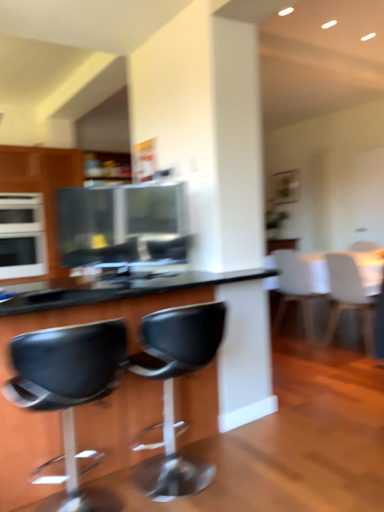
What is the approximate width of white glossy oven at left, the second appliance when ordered from right to left?

It is 25.52 inches.

Find the location of `white matte chair at right, the 4th chair viewed from the front`. white matte chair at right, the 4th chair viewed from the front is located at coordinates (300, 285).

Locate an element on the screen. The height and width of the screenshot is (512, 384). white matte chair at right, acting as the 1th chair starting from the right is located at coordinates (348, 296).

Locate an element on the screen. This screenshot has width=384, height=512. black plastic table at center, the first table positioned from the front is located at coordinates (166, 308).

Image resolution: width=384 pixels, height=512 pixels. Describe the element at coordinates (122, 224) in the screenshot. I see `metallic silver microwave at center, arranged as the second appliance when viewed from the back` at that location.

In order to face black leather stool at lower left, arranged as the 1th chair when viewed from the front, should I rotate leftwards or rightwards?

Turn left by 15.311 degrees to look at black leather stool at lower left, arranged as the 1th chair when viewed from the front.

Image resolution: width=384 pixels, height=512 pixels. Find the location of `white glossy oven at left, which appears as the second appliance when viewed from the front`. white glossy oven at left, which appears as the second appliance when viewed from the front is located at coordinates (22, 236).

Is white matte chair at right, the first chair positioned from the back, positioned before black plastic chair at center, arranged as the 2th chair when viewed from the front?

No, white matte chair at right, the first chair positioned from the back, is further to the viewer.

Starting from the white matte chair at right, which ranks as the second chair in right-to-left order, which chair is the 1st one to the left? Please provide its 2D coordinates.

[(173, 390)]

Based on the photo, is white matte chair at right, the 4th chair viewed from the front, beside black plastic chair at center, the third chair when ordered from back to front?

There is a gap between white matte chair at right, the 4th chair viewed from the front, and black plastic chair at center, the third chair when ordered from back to front.

Can you confirm if white matte chair at right, the first chair positioned from the back, is taller than black plastic chair at center, arranged as the 2th chair when viewed from the front?

Correct, white matte chair at right, the first chair positioned from the back, is much taller as black plastic chair at center, arranged as the 2th chair when viewed from the front.

Is white glossy oven at left, which appears as the second appliance when viewed from the front, situated inside white matte chair at right, which ranks as the second chair in right-to-left order, or outside?

The correct answer is: outside.

Can you confirm if white glossy oven at left, the 1th appliance from the back, is wider than white matte chair at right, the 3th chair in the left-to-right sequence?

Yes, white glossy oven at left, the 1th appliance from the back, is wider than white matte chair at right, the 3th chair in the left-to-right sequence.

Considering the relative sizes of white glossy oven at left, which appears as the second appliance when viewed from the front, and white matte chair at right, which ranks as the second chair in right-to-left order, in the image provided, is white glossy oven at left, which appears as the second appliance when viewed from the front, smaller than white matte chair at right, which ranks as the second chair in right-to-left order,?

Incorrect, white glossy oven at left, which appears as the second appliance when viewed from the front, is not smaller in size than white matte chair at right, which ranks as the second chair in right-to-left order.

Where is `appliance that appears behind the white matte chair at right, arranged as the 4th chair when viewed from the left`? The image size is (384, 512). appliance that appears behind the white matte chair at right, arranged as the 4th chair when viewed from the left is located at coordinates (22, 236).

Does white matte chair at right, arranged as the 4th chair when viewed from the left, have a greater width compared to white glossy oven at left, the 1th appliance from the left?

No.

Is white glossy oven at left, the 1th appliance from the left, inside white matte chair at right, placed as the third chair when sorted from front to back?

No, white glossy oven at left, the 1th appliance from the left, is not a part of white matte chair at right, placed as the third chair when sorted from front to back.

Considering the positions of point (323, 344) and point (17, 213), is point (323, 344) closer or farther from the camera than point (17, 213)?

Point (323, 344) is closer to the camera than point (17, 213).

Which is less distant, (x=315, y=258) or (x=171, y=378)?

The point (x=171, y=378) is in front.

Considering the relative sizes of white glossy table at upper right, marked as the first table in a right-to-left arrangement, and black plastic chair at center, the third chair when ordered from back to front, in the image provided, is white glossy table at upper right, marked as the first table in a right-to-left arrangement, bigger than black plastic chair at center, the third chair when ordered from back to front,?

Correct, white glossy table at upper right, marked as the first table in a right-to-left arrangement, is larger in size than black plastic chair at center, the third chair when ordered from back to front.

Which is more to the left, white glossy table at upper right, placed as the 2th table when sorted from left to right, or black plastic chair at center, arranged as the 2th chair when viewed from the front?

black plastic chair at center, arranged as the 2th chair when viewed from the front, is more to the left.

Is black plastic chair at center, the 3th chair from the right, oriented towards white glossy oven at left, the second appliance when ordered from right to left?

Yes, black plastic chair at center, the 3th chair from the right, is facing white glossy oven at left, the second appliance when ordered from right to left.

Is black plastic chair at center, the 3th chair from the right, beside white glossy oven at left, the 1th appliance from the left?

black plastic chair at center, the 3th chair from the right, and white glossy oven at left, the 1th appliance from the left, are not in contact.

Is black leather stool at lower left, which is counted as the 4th chair, starting from the back, oriented towards white glossy table at upper right, placed as the 2th table when sorted from left to right?

No, black leather stool at lower left, which is counted as the 4th chair, starting from the back, is not facing towards white glossy table at upper right, placed as the 2th table when sorted from left to right.

From the picture: Does black leather stool at lower left, arranged as the 1th chair when viewed from the front, appear on the left side of white glossy table at upper right, placed as the 2th table when sorted from left to right?

Correct, you'll find black leather stool at lower left, arranged as the 1th chair when viewed from the front, to the left of white glossy table at upper right, placed as the 2th table when sorted from left to right.

Is black leather stool at lower left, the first chair from the left, not near white glossy table at upper right, which is the second table from front to back?

Yes, black leather stool at lower left, the first chair from the left, and white glossy table at upper right, which is the second table from front to back, are quite far apart.

Would you say black leather stool at lower left, arranged as the 1th chair when viewed from the front, contains white glossy table at upper right, marked as the first table in a right-to-left arrangement?

No.

Are metallic silver microwave at center, the 1th appliance positioned from the front, and white glossy oven at left, the second appliance when ordered from right to left, far apart?

That's right, there is a large distance between metallic silver microwave at center, the 1th appliance positioned from the front, and white glossy oven at left, the second appliance when ordered from right to left.

In the image, is metallic silver microwave at center, the 1th appliance positioned from the front, on the left side or the right side of white glossy oven at left, the 1th appliance from the left?

metallic silver microwave at center, the 1th appliance positioned from the front, is to the right of white glossy oven at left, the 1th appliance from the left.

Which point is more forward, (62, 261) or (37, 195)?

The point (62, 261) is closer to the camera.

Looking at the image, does metallic silver microwave at center, acting as the 2th appliance starting from the left, seem bigger or smaller compared to white glossy oven at left, which appears as the second appliance when viewed from the front?

Clearly, metallic silver microwave at center, acting as the 2th appliance starting from the left, is smaller in size than white glossy oven at left, which appears as the second appliance when viewed from the front.

From the black plastic chair at center, the third chair when ordered from back to front, count 2nd chairs backward and point to it. Please provide its 2D coordinates.

[(300, 285)]

From the white glossy oven at left, the second appliance when ordered from right to left, count 3rd chair to the right and point to it. Please provide its 2D coordinates.

[(300, 285)]

Which object lies nearer to the anchor point white glossy table at upper right, which is the second table from front to back, metallic silver microwave at center, acting as the 2th appliance starting from the left, or black plastic chair at center, arranged as the 2th chair when viewed from the front?

metallic silver microwave at center, acting as the 2th appliance starting from the left, is closer to white glossy table at upper right, which is the second table from front to back.

Estimate the real-world distances between objects in this image. Which object is further from black leather stool at lower left, arranged as the 1th chair when viewed from the front, white matte chair at right, the 3th chair in the left-to-right sequence, or white matte chair at right, placed as the third chair when sorted from front to back?

white matte chair at right, the 3th chair in the left-to-right sequence.

Which object lies further to the anchor point black plastic chair at center, arranged as the 2th chair when viewed from the front, white glossy oven at left, which appears as the second appliance when viewed from the front, or white matte chair at right, which ranks as the second chair in right-to-left order?

white glossy oven at left, which appears as the second appliance when viewed from the front.

Which object lies nearer to the anchor point white matte chair at right, placed as the third chair when sorted from front to back, black plastic chair at center, acting as the 2th chair starting from the left, or metallic silver microwave at center, arranged as the second appliance when viewed from the back?

metallic silver microwave at center, arranged as the second appliance when viewed from the back, lies closer to white matte chair at right, placed as the third chair when sorted from front to back, than the other object.

Looking at the image, which one is located closer to white glossy table at upper right, marked as the first table in a right-to-left arrangement, black plastic table at center, the second table positioned from the right, or black leather stool at lower left, placed as the fourth chair when sorted from right to left?

black plastic table at center, the second table positioned from the right, lies closer to white glossy table at upper right, marked as the first table in a right-to-left arrangement, than the other object.

Which object lies nearer to the anchor point white glossy oven at left, the second appliance when ordered from right to left, metallic silver microwave at center, acting as the 2th appliance starting from the left, or white matte chair at right, the 3th chair in the left-to-right sequence?

metallic silver microwave at center, acting as the 2th appliance starting from the left, is positioned closer to the anchor white glossy oven at left, the second appliance when ordered from right to left.

Considering their positions, is black plastic table at center, the first table positioned from the front, positioned further to white matte chair at right, which is counted as the second chair, starting from the back, than black leather stool at lower left, which is counted as the 4th chair, starting from the back?

The object further to white matte chair at right, which is counted as the second chair, starting from the back, is black leather stool at lower left, which is counted as the 4th chair, starting from the back.

Estimate the real-world distances between objects in this image. Which object is closer to black leather stool at lower left, arranged as the 1th chair when viewed from the front, black plastic table at center, the second table positioned from the right, or white matte chair at right, acting as the 1th chair starting from the right?

The object closer to black leather stool at lower left, arranged as the 1th chair when viewed from the front, is black plastic table at center, the second table positioned from the right.

In order to click on appliance between white glossy oven at left, the second appliance when ordered from right to left, and white glossy table at upper right, placed as the 2th table when sorted from left to right, in the horizontal direction in this screenshot , I will do `click(122, 224)`.

The width and height of the screenshot is (384, 512). Identify the location of chair positioned between black plastic chair at center, the third chair when ordered from back to front, and white matte chair at right, which ranks as the second chair in right-to-left order, from near to far. (348, 296).

This screenshot has height=512, width=384. In order to click on appliance situated between black plastic table at center, which appears as the first table when viewed from the left, and white glossy table at upper right, placed as the 2th table when sorted from left to right, from left to right in this screenshot , I will do point(122,224).

This screenshot has height=512, width=384. Identify the location of appliance located between black leather stool at lower left, the first chair from the left, and white matte chair at right, the 3th chair in the left-to-right sequence, in the depth direction. (122, 224).